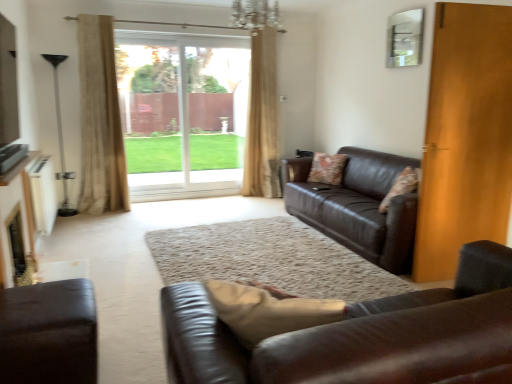
Question: Is matte brown leather couch at right, the 1th studio couch from the back, facing away from leather couch at center, marked as the 1th studio couch in a front-to-back arrangement?

Choices:
 (A) no
 (B) yes

Answer: (A)

Question: From a real-world perspective, is matte brown leather couch at right, the 1th studio couch from the back, positioned under leather couch at center, marked as the 3th studio couch in a back-to-front arrangement, based on gravity?

Choices:
 (A) yes
 (B) no

Answer: (A)

Question: Can you confirm if matte brown leather couch at right, the 1th studio couch from the back, is smaller than leather couch at center, marked as the 3th studio couch in a back-to-front arrangement?

Choices:
 (A) no
 (B) yes

Answer: (A)

Question: Would you say matte brown leather couch at right, the 1th studio couch from the back, contains leather couch at center, marked as the 3th studio couch in a back-to-front arrangement?

Choices:
 (A) yes
 (B) no

Answer: (B)

Question: Is the depth of matte brown leather couch at right, the 1th studio couch from the back, less than that of leather couch at center, marked as the 3th studio couch in a back-to-front arrangement?

Choices:
 (A) no
 (B) yes

Answer: (A)

Question: Is point (105, 172) closer or farther from the camera than point (89, 362)?

Choices:
 (A) farther
 (B) closer

Answer: (A)

Question: Considering the positions of beige textured curtain at left, marked as the 2th curtain in a right-to-left arrangement, and matte brown leather couch at lower left, the 2th studio couch from the front, in the image, is beige textured curtain at left, marked as the 2th curtain in a right-to-left arrangement, taller or shorter than matte brown leather couch at lower left, the 2th studio couch from the front,?

Choices:
 (A) tall
 (B) short

Answer: (A)

Question: From a real-world perspective, relative to matte brown leather couch at lower left, acting as the second studio couch starting from the back, is beige textured curtain at left, which is the first curtain in left-to-right order, vertically above or below?

Choices:
 (A) below
 (B) above

Answer: (B)

Question: In terms of width, does beige textured curtain at left, marked as the 2th curtain in a right-to-left arrangement, look wider or thinner when compared to matte brown leather couch at lower left, the 2th studio couch from the front?

Choices:
 (A) thin
 (B) wide

Answer: (A)

Question: Considering the positions of point (385, 167) and point (245, 152), is point (385, 167) closer or farther from the camera than point (245, 152)?

Choices:
 (A) closer
 (B) farther

Answer: (A)

Question: From the image's perspective, is matte brown leather couch at right, the 1th studio couch from the back, positioned above or below beige textured curtain at center, which appears as the 1th curtain when viewed from the right?

Choices:
 (A) above
 (B) below

Answer: (B)

Question: Is matte brown leather couch at right, the 1th studio couch from the back, bigger or smaller than beige textured curtain at center, marked as the 1th curtain in a back-to-front arrangement?

Choices:
 (A) small
 (B) big

Answer: (B)

Question: Based on their positions, is matte brown leather couch at right, which ranks as the 3th studio couch in front-to-back order, located to the left or right of beige textured curtain at center, marked as the 1th curtain in a back-to-front arrangement?

Choices:
 (A) left
 (B) right

Answer: (B)

Question: In the image, is beige textured curtain at center, marked as the 1th curtain in a back-to-front arrangement, positioned in front of or behind crystal glass chandelier at upper center?

Choices:
 (A) behind
 (B) front

Answer: (A)

Question: Would you say beige textured curtain at center, the second curtain positioned from the front, is inside or outside crystal glass chandelier at upper center?

Choices:
 (A) inside
 (B) outside

Answer: (B)